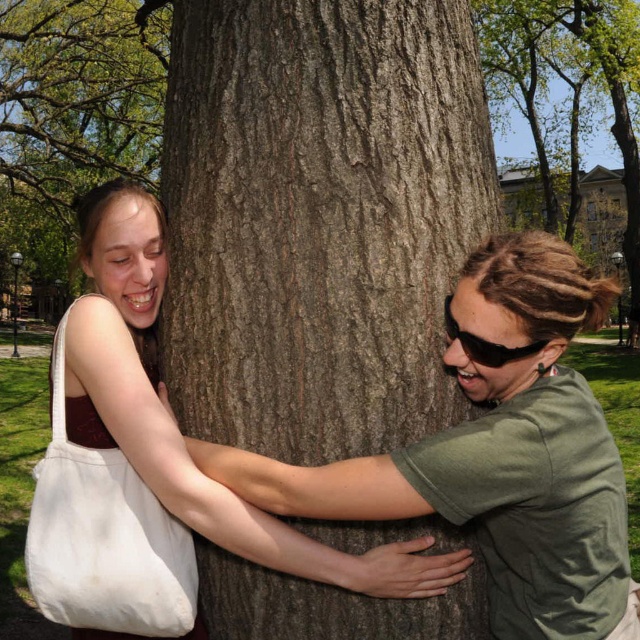
Does smooth brown bark at center have a larger size compared to white canvas tote at left?

Yes, smooth brown bark at center is bigger than white canvas tote at left.

Can you confirm if smooth brown bark at center is positioned to the right of white canvas tote at left?

No, smooth brown bark at center is not to the right of white canvas tote at left.

Is point (116, 19) less distant than point (177, 604)?

No, (116, 19) is further to viewer.

This screenshot has width=640, height=640. Find the location of `smooth brown bark at center`. smooth brown bark at center is located at coordinates (74, 109).

Looking at this image, who is lower down, brown rough tree trunk at center or smooth bark tree at center?

brown rough tree trunk at center

Is brown rough tree trunk at center behind smooth bark tree at center?

No, it is not.

Image resolution: width=640 pixels, height=640 pixels. What are the coordinates of `brown rough tree trunk at center` in the screenshot? It's located at (317, 218).

Identify the location of brown rough tree trunk at center. [317, 218].

Is white canvas tote at left shorter than black plastic goggles at right?

No, white canvas tote at left is not shorter than black plastic goggles at right.

Is white canvas tote at left taller than black plastic goggles at right?

Yes.

Between point (45, 556) and point (451, 337), which one is positioned behind?

Positioned behind is point (451, 337).

Locate an element on the screen. white canvas tote at left is located at coordinates (104, 536).